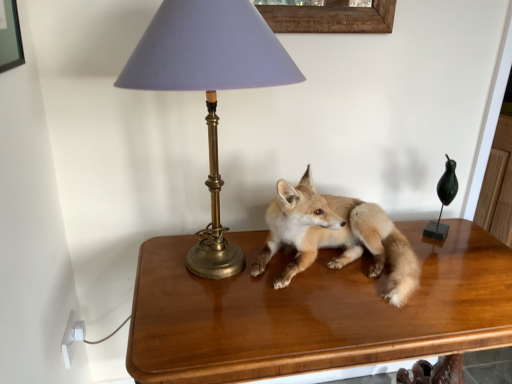
Measure the distance between point (417, 283) and camera.

The depth of point (417, 283) is 1.04 meters.

Find the location of a particular element. This screenshot has height=384, width=512. shiny brown table at center is located at coordinates (313, 310).

From a real-world perspective, who is located higher, light brown fur fox at center or matte gold lamp at upper left?

matte gold lamp at upper left is physically above.

This screenshot has width=512, height=384. What are the coordinates of `lamp above the light brown fur fox at center (from a real-world perspective)` in the screenshot? It's located at (209, 87).

From the image's perspective, which one is positioned lower, light brown fur fox at center or matte gold lamp at upper left?

light brown fur fox at center appears lower in the image.

Can you tell me how much shiny brown table at center and matte gold lamp at upper left differ in facing direction?

They differ by 0.476 degrees in their facing directions.

Based on the photo, how distant is shiny brown table at center from matte gold lamp at upper left?

shiny brown table at center is 22.05 inches away from matte gold lamp at upper left.

Considering the relative positions of shiny brown table at center and matte gold lamp at upper left in the image provided, is shiny brown table at center to the left or to the right of matte gold lamp at upper left?

shiny brown table at center is positioned on matte gold lamp at upper left's right side.

Who is bigger, shiny brown table at center or matte gold lamp at upper left?

Bigger between the two is shiny brown table at center.

Looking at this image, from the image's perspective, relative to light brown fur fox at center, is shiny brown table at center above or below?

shiny brown table at center is below light brown fur fox at center.

Is shiny brown table at center inside or outside of light brown fur fox at center?

shiny brown table at center is spatially situated outside light brown fur fox at center.

Is shiny brown table at center directly adjacent to light brown fur fox at center?

No, shiny brown table at center is not beside light brown fur fox at center.

In terms of height, does shiny brown table at center look taller or shorter compared to light brown fur fox at center?

Considering their sizes, shiny brown table at center has more height than light brown fur fox at center.

Which of these two, light brown fur fox at center or shiny brown table at center, is thinner?

light brown fur fox at center.

Based on their sizes in the image, would you say light brown fur fox at center is bigger or smaller than shiny brown table at center?

In the image, light brown fur fox at center appears to be smaller than shiny brown table at center.

Does light brown fur fox at center have a greater height compared to shiny brown table at center?

No.

Could you tell me if light brown fur fox at center is turned towards shiny brown table at center?

No, light brown fur fox at center is not turned towards shiny brown table at center.

Consider the image. How far apart are matte gold lamp at upper left and light brown fur fox at center?

A distance of 17.44 inches exists between matte gold lamp at upper left and light brown fur fox at center.

From the image's perspective, relative to light brown fur fox at center, is matte gold lamp at upper left above or below?

From the image's perspective, matte gold lamp at upper left appears above light brown fur fox at center.

Is matte gold lamp at upper left located outside light brown fur fox at center?

Yes, matte gold lamp at upper left is located beyond the bounds of light brown fur fox at center.

Between matte gold lamp at upper left and light brown fur fox at center, which one is positioned behind?

light brown fur fox at center.

In terms of width, does matte gold lamp at upper left look wider or thinner when compared to shiny brown table at center?

In the image, matte gold lamp at upper left appears to be more narrow than shiny brown table at center.

Looking at this image, is matte gold lamp at upper left inside or outside of shiny brown table at center?

matte gold lamp at upper left is located beyond the bounds of shiny brown table at center.

Which object is further away from the camera taking this photo, matte gold lamp at upper left or shiny brown table at center?

shiny brown table at center is further from the camera.

From a real-world perspective, is matte gold lamp at upper left above or below shiny brown table at center?

matte gold lamp at upper left is above shiny brown table at center.

The image size is (512, 384). Identify the location of lamp that appears above the light brown fur fox at center (from a real-world perspective). (209, 87).

Where is `lamp in front of the shiny brown table at center`? The height and width of the screenshot is (384, 512). lamp in front of the shiny brown table at center is located at coordinates (209, 87).

Based on their spatial positions, is matte gold lamp at upper left or shiny brown table at center closer to light brown fur fox at center?

Based on the image, shiny brown table at center appears to be nearer to light brown fur fox at center.

Estimate the real-world distances between objects in this image. Which object is closer to matte gold lamp at upper left, shiny brown table at center or light brown fur fox at center?

The object closer to matte gold lamp at upper left is light brown fur fox at center.

Looking at the image, which one is located further to shiny brown table at center, matte gold lamp at upper left or light brown fur fox at center?

matte gold lamp at upper left is positioned further to the anchor shiny brown table at center.

Which object lies further to the anchor point light brown fur fox at center, shiny brown table at center or matte gold lamp at upper left?

The object further to light brown fur fox at center is matte gold lamp at upper left.

Which object lies nearer to the anchor point shiny brown table at center, light brown fur fox at center or matte gold lamp at upper left?

light brown fur fox at center is closer to shiny brown table at center.

Based on the photo, when comparing their distances from matte gold lamp at upper left, does light brown fur fox at center or shiny brown table at center seem further?

shiny brown table at center.

Where is `fox between matte gold lamp at upper left and shiny brown table at center in the vertical direction`? This screenshot has width=512, height=384. fox between matte gold lamp at upper left and shiny brown table at center in the vertical direction is located at coordinates (336, 236).